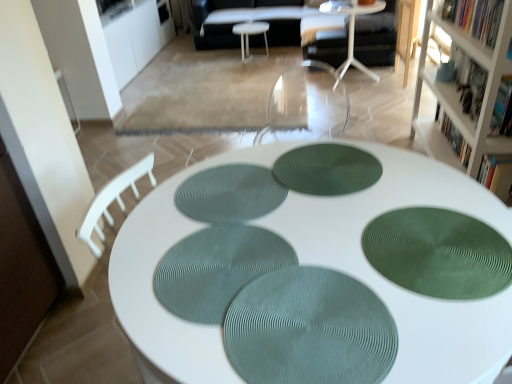
You are a GUI agent. You are given a task and a screenshot of the screen. Output one action in this format:
    pyautogui.click(x=<x>, y=<y>)
    Task: Click on the vacant area on top of teal textured placemat at center, the third mat viewed from the right (from a real-world perspective)
    
    Given the screenshot: What is the action you would take?
    pyautogui.click(x=225, y=268)